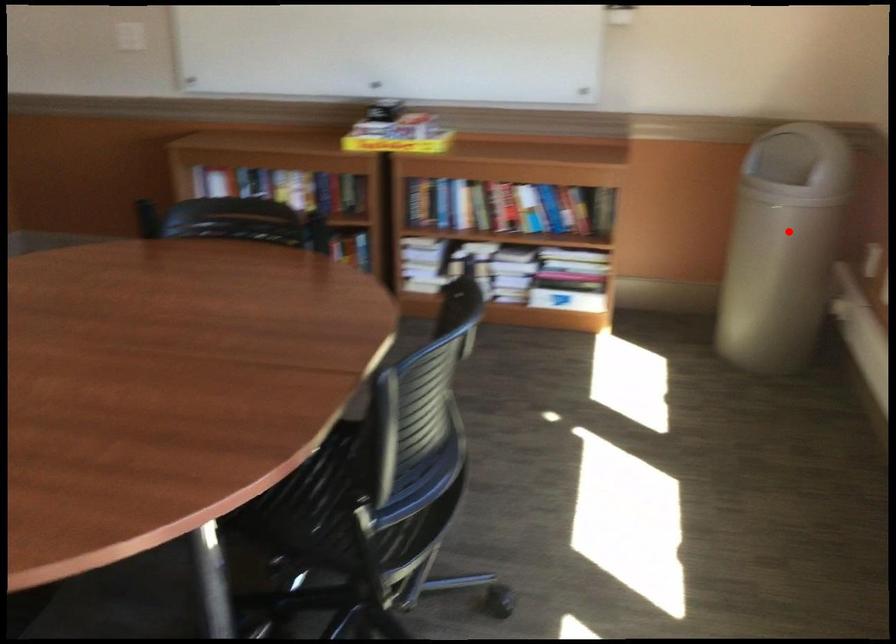
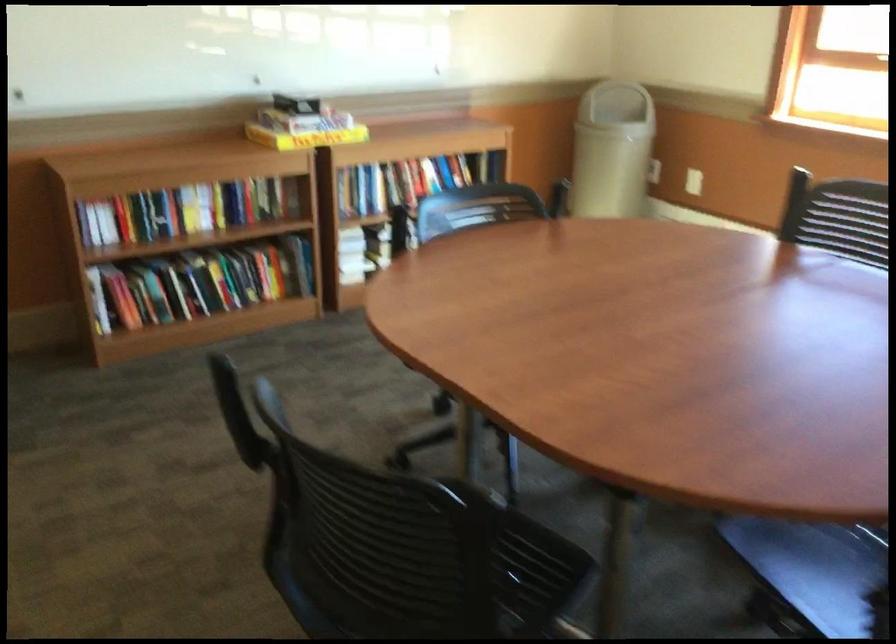
Locate, in the second image, the point that corresponds to the highlighted location in the first image.

(612, 149)